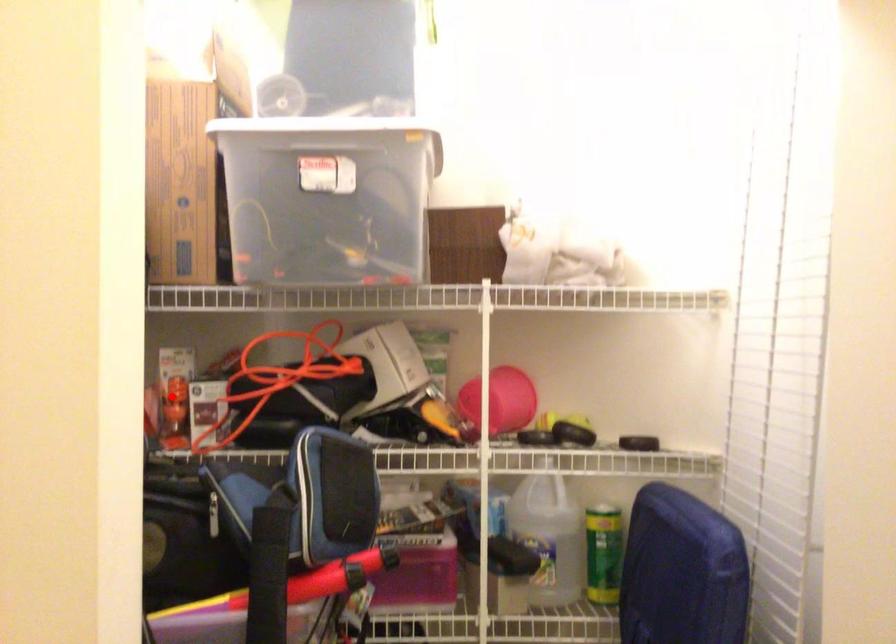
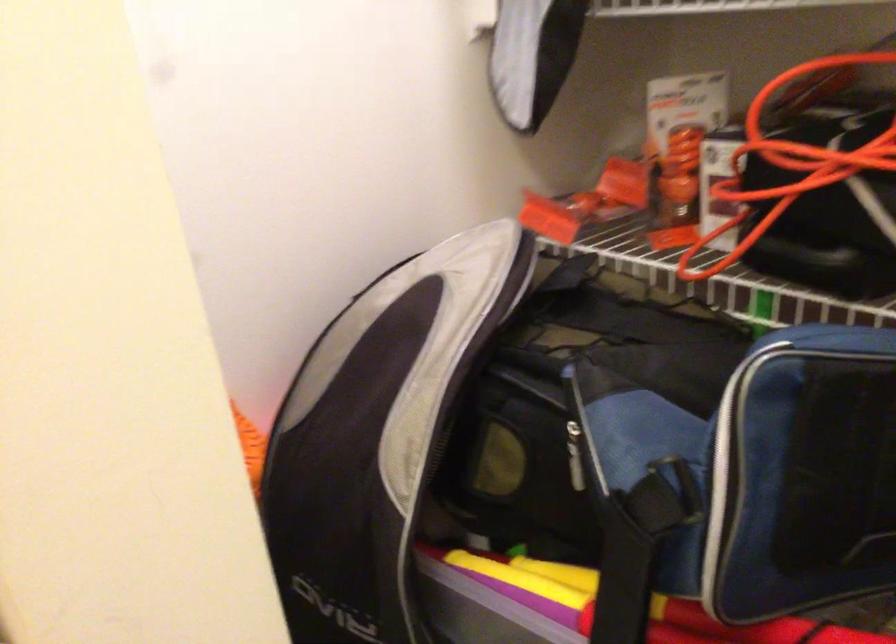
Question: I am providing you with two images of the same scene from different viewpoints. Image1 has a red point marked. In image2, the corresponding 3D location appears at what relative position? Reply with the corresponding letter.

Choices:
 (A) Closer
 (B) Farther

Answer: (A)